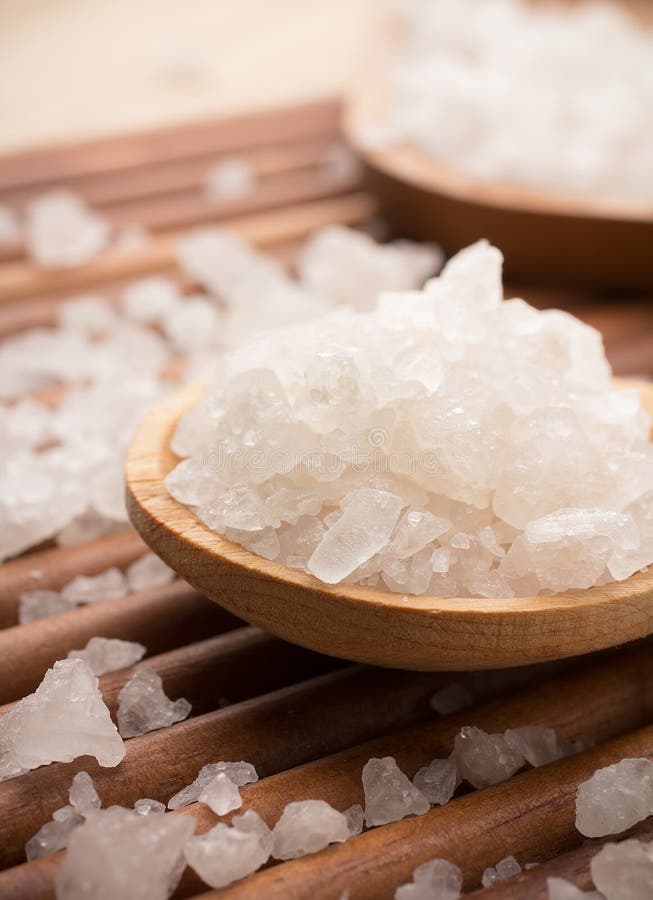
Where is `wooden dowels`? The width and height of the screenshot is (653, 900). wooden dowels is located at coordinates (490, 824), (323, 778), (275, 738), (155, 612), (86, 558), (25, 313), (159, 249), (170, 208), (142, 176), (114, 151).